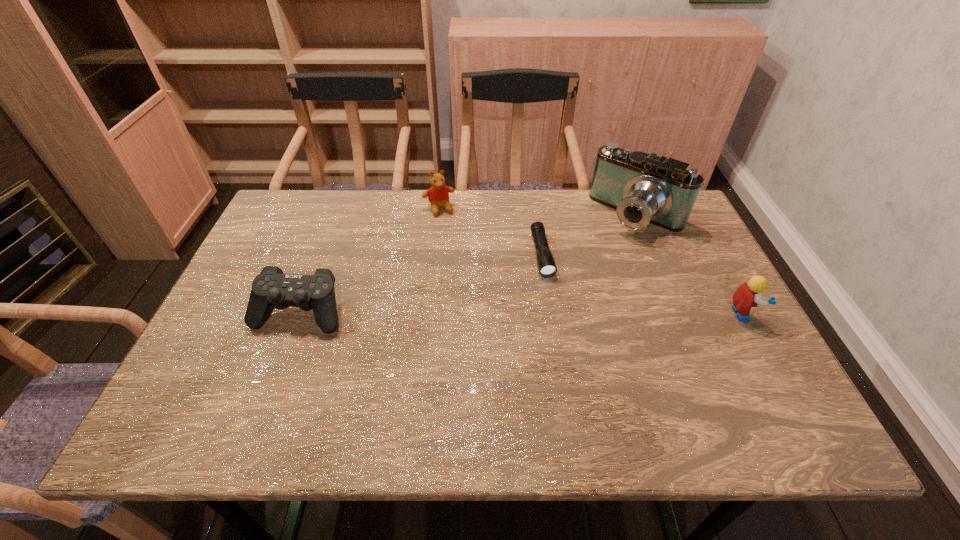
Where is `object that is positioned at the left edge`? The width and height of the screenshot is (960, 540). object that is positioned at the left edge is located at coordinates (271, 288).

At what (x,y) coordinates should I click in order to perform the action: click on Lego at the right edge. Please return your answer as a coordinate pair (x, y). Looking at the image, I should click on point(748,295).

This screenshot has height=540, width=960. What are the coordinates of `camcorder that is at the right edge` in the screenshot? It's located at (643, 188).

What are the coordinates of `object that is at the far right corner` in the screenshot? It's located at (643, 188).

Image resolution: width=960 pixels, height=540 pixels. I want to click on vacant space at the far edge of the desktop, so click(588, 195).

This screenshot has height=540, width=960. I want to click on vacant space at the near edge of the desktop, so click(330, 394).

You are a GUI agent. You are given a task and a screenshot of the screen. Output one action in this format:
    pyautogui.click(x=<x>, y=<y>)
    Task: Click on the vacant space at the left edge
    This screenshot has width=960, height=540.
    Given the screenshot: What is the action you would take?
    pyautogui.click(x=285, y=272)

Where is `vacant space at the right edge of the desktop`? vacant space at the right edge of the desktop is located at coordinates (673, 255).

What are the coordinates of `vacant region at the far right corner of the desktop` in the screenshot? It's located at (647, 226).

This screenshot has height=540, width=960. Identify the location of vacant point at the near right corner. (736, 392).